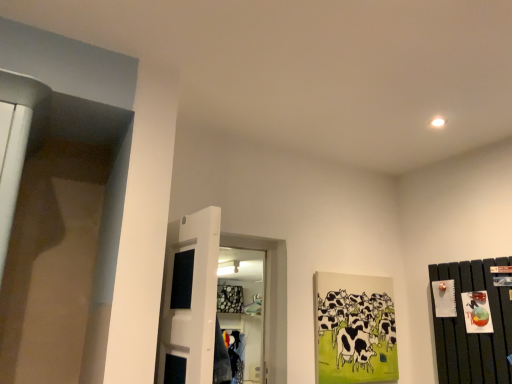
The height and width of the screenshot is (384, 512). What do you see at coordinates (190, 302) in the screenshot?
I see `white glossy door at center` at bounding box center [190, 302].

Find the location of `white glossy door at center`. white glossy door at center is located at coordinates (190, 302).

The height and width of the screenshot is (384, 512). Find the location of `dark wood dresser at right`. dark wood dresser at right is located at coordinates (472, 334).

At what (x,y) coordinates should I click in order to perform the action: click on black and white painted cows at center right. Please return your answer as a coordinate pair (x, y). Looking at the image, I should click on (356, 337).

Locate an element on the screen. white glossy door at center is located at coordinates (190, 302).

How many degrees apart are the facing directions of black and white painted cows at center right and white glossy door at center?

The angular difference between black and white painted cows at center right and white glossy door at center is 95.2 degrees.

Is black and white painted cows at center right not inside white glossy door at center?

Yes, black and white painted cows at center right is not within white glossy door at center.

Is black and white painted cows at center right smaller than white glossy door at center?

Indeed, black and white painted cows at center right has a smaller size compared to white glossy door at center.

Does point (334, 328) come closer to viewer compared to point (179, 354)?

No.

From the image's perspective, is white glossy door at center on top of black and white painted cows at center right?

Indeed, from the image's perspective, white glossy door at center is shown above black and white painted cows at center right.

From a real-world perspective, is white glossy door at center positioned under black and white painted cows at center right based on gravity?

No, from a real-world perspective, white glossy door at center is not beneath black and white painted cows at center right.

What are the coordinates of `door above the black and white painted cows at center right (from a real-world perspective)` in the screenshot? It's located at (190, 302).

Is white glossy door at center thinner than black and white painted cows at center right?

No.

Is white glossy door at center in front of dark wood dresser at right?

Yes, the depth of white glossy door at center is less than that of dark wood dresser at right.

Would you say dark wood dresser at right is part of white glossy door at center's contents?

No.

From the image's perspective, is white glossy door at center located above dark wood dresser at right?

Indeed, from the image's perspective, white glossy door at center is shown above dark wood dresser at right.

From a real-world perspective, is white glossy door at center physically below dark wood dresser at right?

No, from a real-world perspective, white glossy door at center is not beneath dark wood dresser at right.

From a real-world perspective, is dark wood dresser at right under white glossy door at center?

Yes, from a real-world perspective, dark wood dresser at right is below white glossy door at center.

Considering the sizes of objects dark wood dresser at right and white glossy door at center in the image provided, who is smaller, dark wood dresser at right or white glossy door at center?

dark wood dresser at right.

Is white glossy door at center located within dark wood dresser at right?

Definitely not — white glossy door at center is not inside dark wood dresser at right.

How different are the orientations of dark wood dresser at right and white glossy door at center in degrees?

The angle between the facing direction of dark wood dresser at right and the facing direction of white glossy door at center is 34 degrees.

The width and height of the screenshot is (512, 384). What are the coordinates of `dresser in front of the black and white painted cows at center right` in the screenshot? It's located at (472, 334).

Looking at this image, which is nearer, (333, 314) or (459, 292)?

Point (333, 314) appears to be farther away from the viewer than point (459, 292).

From the image's perspective, which is below, black and white painted cows at center right or dark wood dresser at right?

black and white painted cows at center right is shown below in the image.

Is black and white painted cows at center right next to dark wood dresser at right and touching it?

No, black and white painted cows at center right is not next to dark wood dresser at right.

From the image's perspective, does dark wood dresser at right appear higher than black and white painted cows at center right?

Indeed, from the image's perspective, dark wood dresser at right is shown above black and white painted cows at center right.

Find the location of a particular element. dresser above the black and white painted cows at center right (from a real-world perspective) is located at coordinates (472, 334).

Is dark wood dresser at right wider or thinner than black and white painted cows at center right?

Clearly, dark wood dresser at right has more width compared to black and white painted cows at center right.

Where is `animal below the white glossy door at center (from a real-world perspective)`? animal below the white glossy door at center (from a real-world perspective) is located at coordinates (356, 337).

Find the location of `door to the left of black and white painted cows at center right`. door to the left of black and white painted cows at center right is located at coordinates (190, 302).

Considering their positions, is dark wood dresser at right positioned closer to black and white painted cows at center right than white glossy door at center?

Among the two, dark wood dresser at right is located nearer to black and white painted cows at center right.

Estimate the real-world distances between objects in this image. Which object is further from dark wood dresser at right, white glossy door at center or black and white painted cows at center right?

Among the two, white glossy door at center is located further to dark wood dresser at right.

When comparing their distances from black and white painted cows at center right, does white glossy door at center or dark wood dresser at right seem closer?

The object closer to black and white painted cows at center right is dark wood dresser at right.

Looking at the image, which one is located further to dark wood dresser at right, black and white painted cows at center right or white glossy door at center?

white glossy door at center lies further to dark wood dresser at right than the other object.

Which object lies further to the anchor point white glossy door at center, black and white painted cows at center right or dark wood dresser at right?

The object further to white glossy door at center is dark wood dresser at right.

Looking at the image, which one is located closer to white glossy door at center, dark wood dresser at right or black and white painted cows at center right?

black and white painted cows at center right lies closer to white glossy door at center than the other object.

You are a GUI agent. You are given a task and a screenshot of the screen. Output one action in this format:
    pyautogui.click(x=<x>, y=<y>)
    Task: Click on the animal located between white glossy door at center and dark wood dresser at right in the left-right direction
    The width and height of the screenshot is (512, 384).
    Given the screenshot: What is the action you would take?
    pyautogui.click(x=356, y=337)